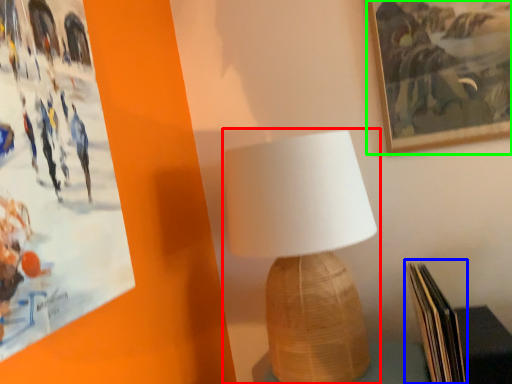
Question: Which is farther away from lamp (highlighted by a red box)? paperback book (highlighted by a blue box) or picture frame (highlighted by a green box)?

Choices:
 (A) paperback book
 (B) picture frame

Answer: (B)